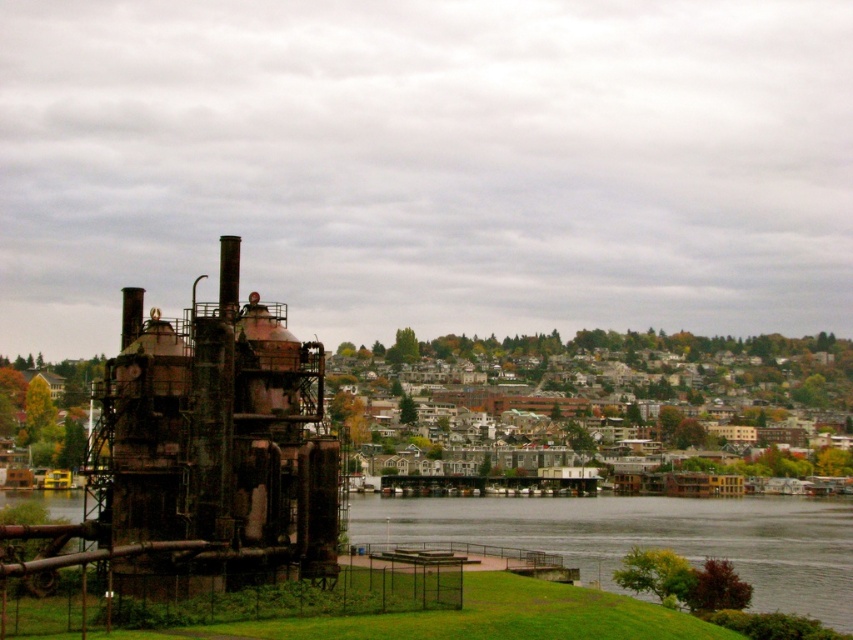
You are standing on the grassy area near the rusty metal structure at left and want to reach the dark gray water at lower center. Which direction should you walk to get there?

You should walk to the right because the rusty metal structure at left is positioned on the left side of the dark gray water at lower center, so moving right would lead towards the water.

You are standing at the edge of the dark gray water at lower center and want to take a photo of the rusty metal industrial structure at left. Will the structure appear larger or smaller in your photo compared to the water?

The structure will appear larger in your photo because the rusty metal industrial structure at left is much taller than the dark gray water at lower center.